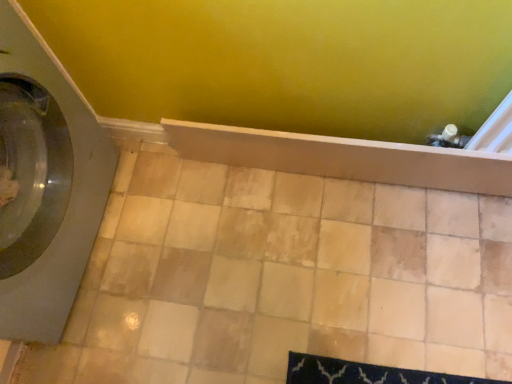
Question: From a real-world perspective, is satin gray washing machine at left over wooden shelf at center?

Choices:
 (A) no
 (B) yes

Answer: (B)

Question: Does satin gray washing machine at left appear on the right side of wooden shelf at center?

Choices:
 (A) no
 (B) yes

Answer: (A)

Question: Is satin gray washing machine at left shorter than wooden shelf at center?

Choices:
 (A) yes
 (B) no

Answer: (B)

Question: From a real-world perspective, is satin gray washing machine at left under wooden shelf at center?

Choices:
 (A) no
 (B) yes

Answer: (A)

Question: Does satin gray washing machine at left lie behind wooden shelf at center?

Choices:
 (A) yes
 (B) no

Answer: (B)

Question: From the image's perspective, is satin gray washing machine at left located above or below wooden shelf at center?

Choices:
 (A) below
 (B) above

Answer: (A)

Question: Is satin gray washing machine at left wider or thinner than wooden shelf at center?

Choices:
 (A) wide
 (B) thin

Answer: (A)

Question: From a real-world perspective, relative to wooden shelf at center, is satin gray washing machine at left vertically above or below?

Choices:
 (A) below
 (B) above

Answer: (B)

Question: Is satin gray washing machine at left taller or shorter than wooden shelf at center?

Choices:
 (A) short
 (B) tall

Answer: (B)

Question: Is wooden shelf at center situated inside beige ceramic tile at center or outside?

Choices:
 (A) outside
 (B) inside

Answer: (A)

Question: Is wooden shelf at center in front of or behind beige ceramic tile at center in the image?

Choices:
 (A) behind
 (B) front

Answer: (B)

Question: Considering the positions of wooden shelf at center and beige ceramic tile at center in the image, is wooden shelf at center bigger or smaller than beige ceramic tile at center?

Choices:
 (A) small
 (B) big

Answer: (A)

Question: From the image's perspective, is wooden shelf at center positioned above or below beige ceramic tile at center?

Choices:
 (A) above
 (B) below

Answer: (A)

Question: From the image's perspective, is beige ceramic tile at center located above or below wooden shelf at center?

Choices:
 (A) below
 (B) above

Answer: (A)

Question: From a real-world perspective, is beige ceramic tile at center above or below wooden shelf at center?

Choices:
 (A) above
 (B) below

Answer: (B)